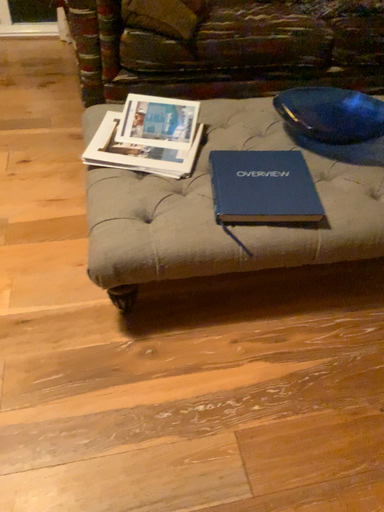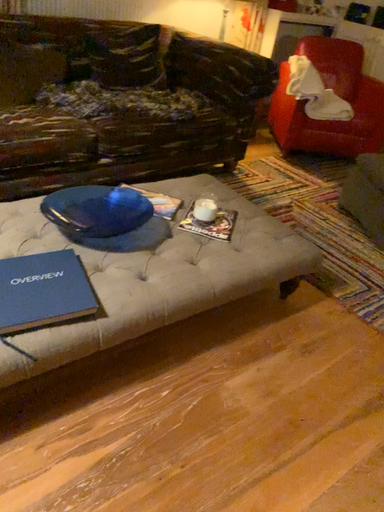
Question: Which way did the camera rotate in the video?

Choices:
 (A) rotated right
 (B) rotated left

Answer: (A)